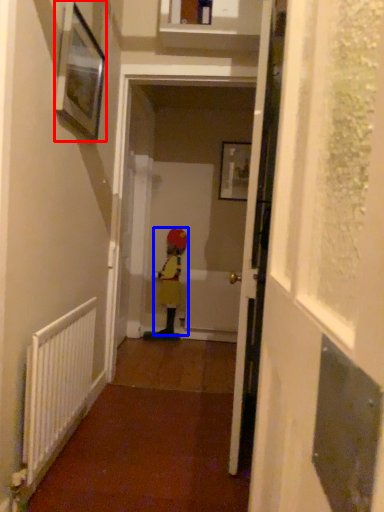
Question: Which of the following is the farthest to the observer, picture frame (highlighted by a red box) or person (highlighted by a blue box)?

Choices:
 (A) picture frame
 (B) person

Answer: (B)